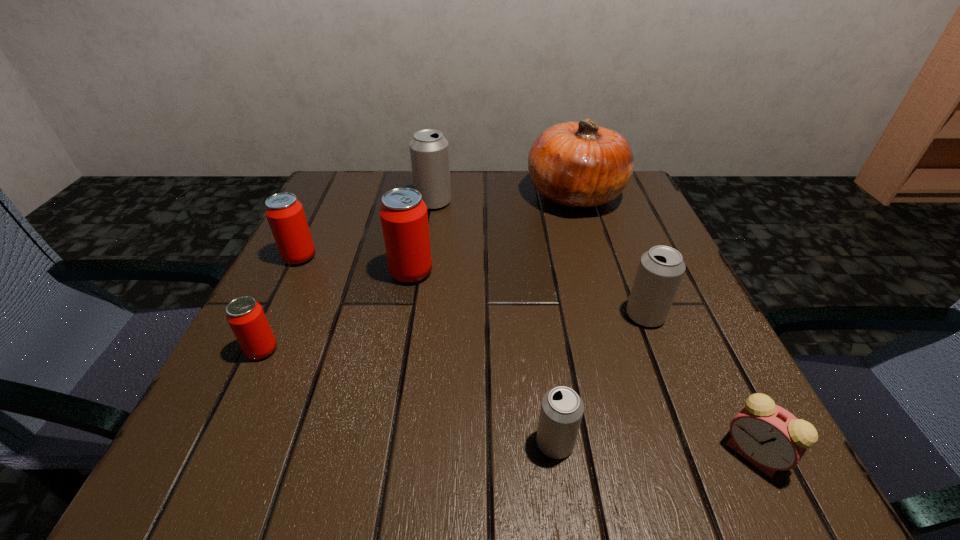
This screenshot has width=960, height=540. What are the coordinates of `blank region between the biggest red beer can and the second nearest beer can` in the screenshot? It's located at click(x=337, y=311).

This screenshot has width=960, height=540. What are the coordinates of `vacant space that's between the second smallest white beer can and the second nearest beer can` in the screenshot? It's located at [x=454, y=333].

At what (x,y) coordinates should I click in order to perform the action: click on vacant space in between the pink alarm clock and the second biggest red beer can. Please return your answer as a coordinate pair (x, y). The width and height of the screenshot is (960, 540). Looking at the image, I should click on (526, 355).

At what (x,y) coordinates should I click in order to perform the action: click on empty space between the nearest beer can and the alarm clock. Please return your answer as a coordinate pair (x, y). The width and height of the screenshot is (960, 540). Looking at the image, I should click on [654, 448].

Find the location of a particular element. The width and height of the screenshot is (960, 540). vacant point located between the rightmost red beer can and the second smallest red beer can is located at coordinates (355, 265).

The height and width of the screenshot is (540, 960). Identify the location of the fourth closest object to the second smallest red beer can. (580, 164).

Find the location of `object that is the third closest to the farthest white beer can`. object that is the third closest to the farthest white beer can is located at coordinates (285, 214).

Find the location of a particular element. Image resolution: width=960 pixels, height=540 pixels. beer can that is the nearest to the fifth farthest beer can is located at coordinates (285, 214).

Locate which beer can is the fourth closest to the alarm clock. Please provide its 2D coordinates. Your answer should be formatted as a tuple, i.e. [(x, y)], where the tuple contains the x and y coordinates of a point satisfying the conditions above.

[(245, 316)]

The height and width of the screenshot is (540, 960). Find the location of `white beer can that is the second nearest to the orange pumpkin`. white beer can that is the second nearest to the orange pumpkin is located at coordinates (660, 271).